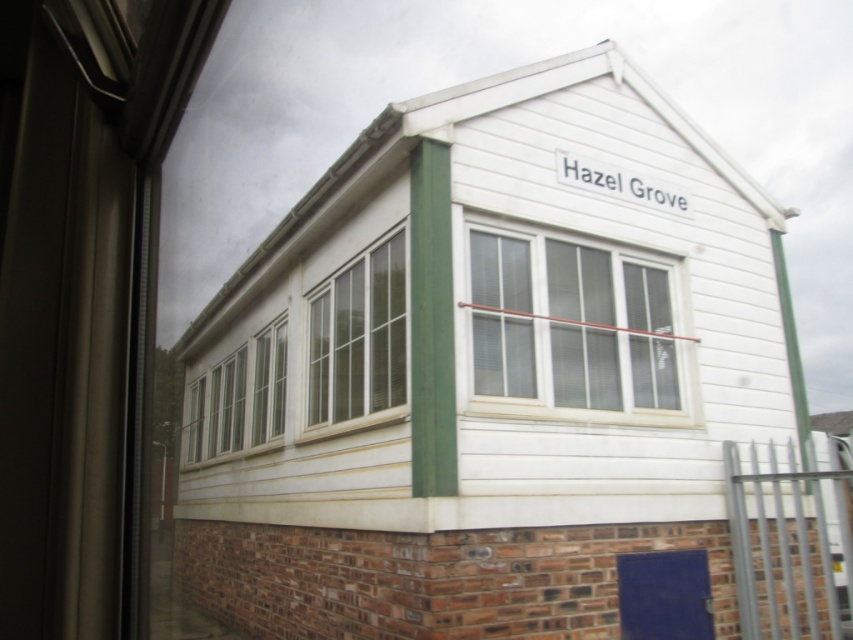
Question: Can you confirm if white plastic window at center is positioned to the left of white glass window at center?

Choices:
 (A) no
 (B) yes

Answer: (A)

Question: Which point is closer to the camera?

Choices:
 (A) click(686, 381)
 (B) click(369, 332)
 (C) click(184, 458)

Answer: (A)

Question: Is white wood window at center above white glass window at center?

Choices:
 (A) no
 (B) yes

Answer: (B)

Question: Which object is farther from the camera taking this photo?

Choices:
 (A) white plastic window at center
 (B) white wood window at center
 (C) white glass window at center

Answer: (C)

Question: Can you confirm if white plastic window at center is wider than white glass window at center?

Choices:
 (A) no
 (B) yes

Answer: (A)

Question: Which of the following is the farthest from the observer?

Choices:
 (A) (252, 364)
 (B) (579, 368)

Answer: (A)